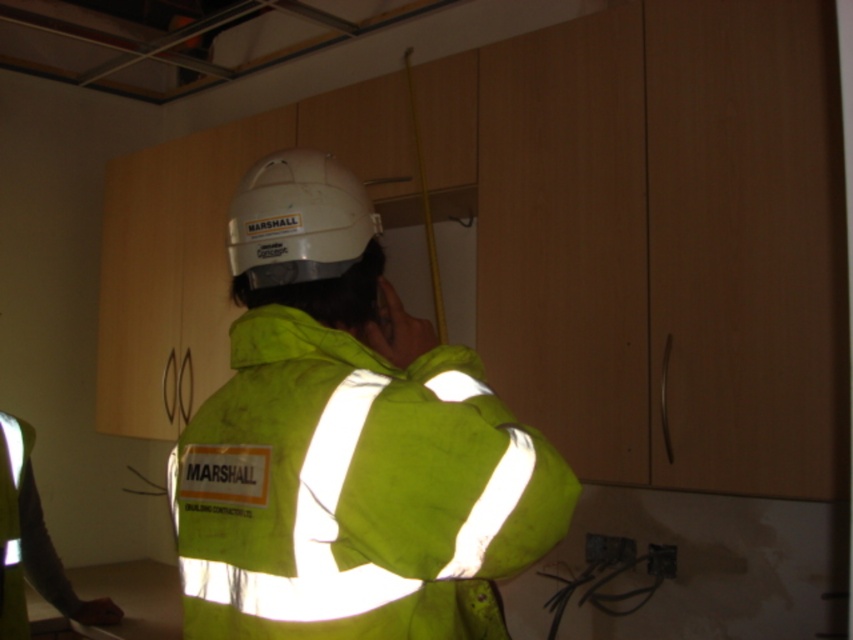
Can you confirm if reflective yellow jacket at center is thinner than white matte helmet at center?

In fact, reflective yellow jacket at center might be wider than white matte helmet at center.

Locate an element on the screen. The image size is (853, 640). reflective yellow jacket at center is located at coordinates (347, 442).